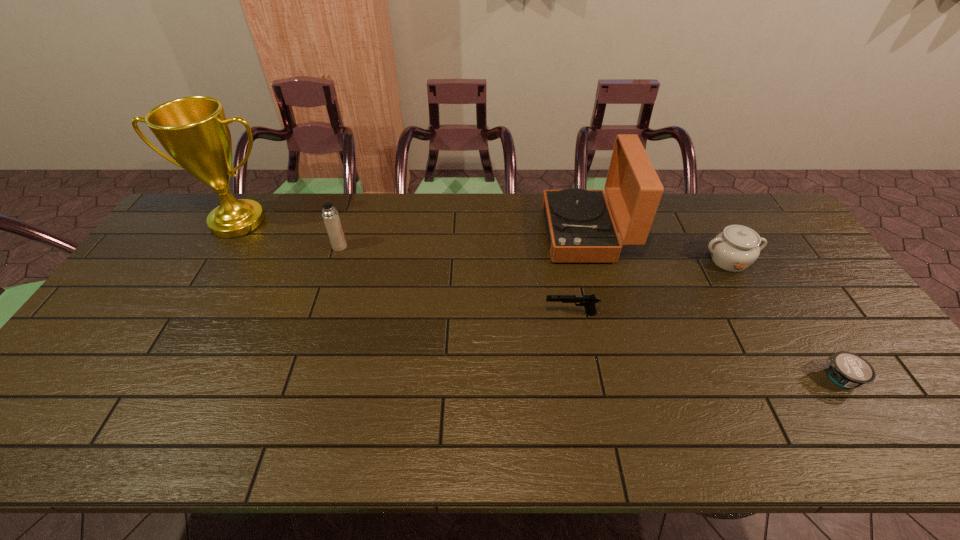
The width and height of the screenshot is (960, 540). Identify the location of free area in between the gun and the chinaware. (650, 287).

Where is `vacant area between the fifth farthest object and the shortest object`? vacant area between the fifth farthest object and the shortest object is located at coordinates point(705,346).

You are a GUI agent. You are given a task and a screenshot of the screen. Output one action in this format:
    pyautogui.click(x=<x>, y=<y>)
    Task: Click on the free spot between the phonograph record and the gun
    The width and height of the screenshot is (960, 540).
    Given the screenshot: What is the action you would take?
    pyautogui.click(x=578, y=274)

Where is `free space between the gun and the thermos bottle`? This screenshot has height=540, width=960. free space between the gun and the thermos bottle is located at coordinates (455, 280).

Locate an element on the screen. blank region between the fifth object from right to left and the fifth tallest object is located at coordinates 455,280.

In order to click on vacant space in between the chinaware and the fifth farthest object in this screenshot , I will do `click(650, 287)`.

I want to click on free point between the nearest object and the phonograph record, so click(712, 306).

Where is `vacant region between the phonograph record and the gun`? vacant region between the phonograph record and the gun is located at coordinates (578, 274).

Locate an element on the screen. The width and height of the screenshot is (960, 540). unoccupied area between the third shortest object and the tallest object is located at coordinates click(x=483, y=241).

Identify which object is the nearest to the second shortest object. Please provide its 2D coordinates. Your answer should be formatted as a tuple, i.e. [(x, y)], where the tuple contains the x and y coordinates of a point satisfying the conditions above.

[(579, 224)]